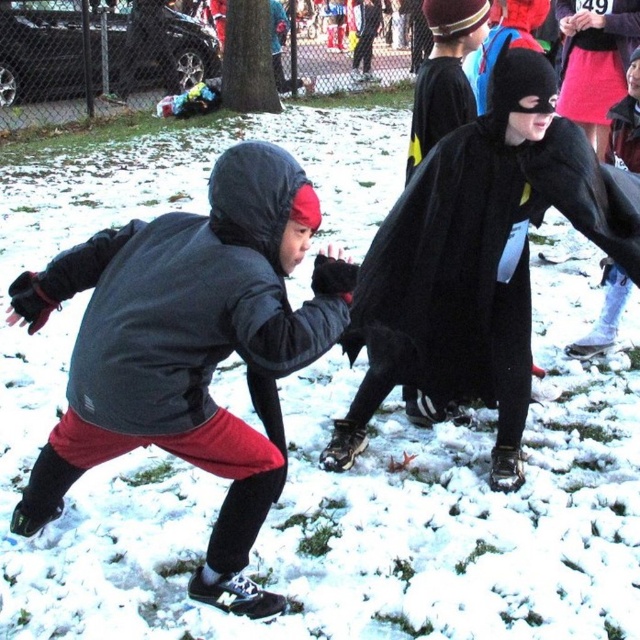
You are a photographer trying to capture a photo of both the matte black jacket at left and the black matte cape at center. Based on their positions, which object should you focus on first to ensure both are in frame?

The matte black jacket at left is to the left of black matte cape at center, so you should focus on the matte black jacket at left first to ensure both are in frame.

In the scene of children playing in the snow, where exactly is the matte black jacket at left located in terms of coordinates?

The matte black jacket at left is located at coordinates point (189, 349).